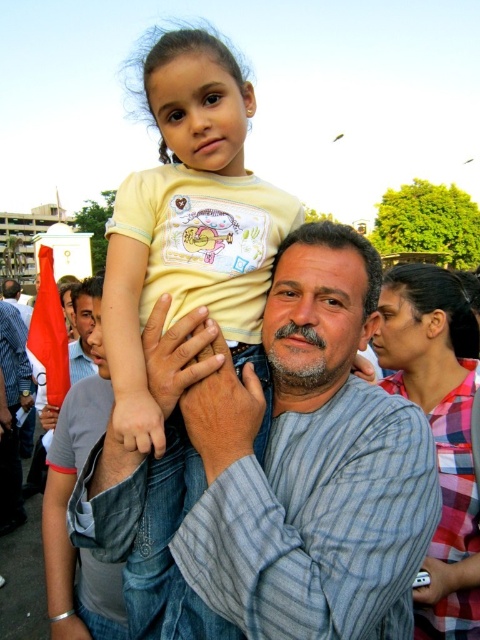
Does striped cotton shirt at center appear over gray striped shirt at center?

Actually, striped cotton shirt at center is below gray striped shirt at center.

You are a GUI agent. You are given a task and a screenshot of the screen. Output one action in this format:
    pyautogui.click(x=<x>, y=<y>)
    Task: Click on the striped cotton shirt at center
    
    Given the screenshot: What is the action you would take?
    pyautogui.click(x=285, y=461)

Where is `striped cotton shirt at center`? striped cotton shirt at center is located at coordinates (285, 461).

Is yellow matte shirt at upper center thinner than gray striped shirt at center?

Correct, yellow matte shirt at upper center's width is less than gray striped shirt at center's.

Who is shorter, yellow matte shirt at upper center or gray striped shirt at center?

Standing shorter between the two is gray striped shirt at center.

Image resolution: width=480 pixels, height=640 pixels. I want to click on yellow matte shirt at upper center, so click(x=189, y=220).

Where is `yellow matte shirt at upper center`? yellow matte shirt at upper center is located at coordinates (189, 220).

Is point (478, 372) closer to camera compared to point (20, 310)?

That is True.

Who is higher up, matte yellow shirt at upper center or gray striped shirt at center?

Positioned higher is gray striped shirt at center.

Does point (409, 349) come closer to viewer compared to point (25, 324)?

Yes, it is in front of point (25, 324).

This screenshot has width=480, height=640. In order to click on matte yellow shirt at upper center in this screenshot , I will do `click(439, 429)`.